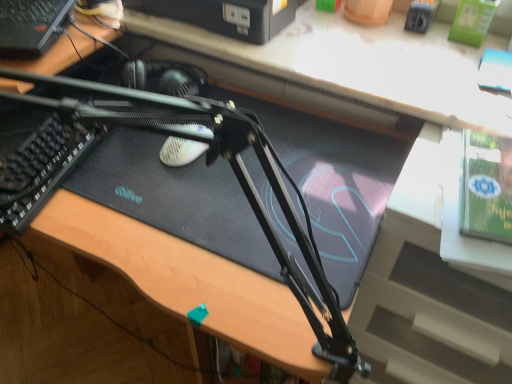
Question: Considering the positions of black plastic computer at upper left, arranged as the second computer when viewed from the right, and black textured keyboard at left in the image, is black plastic computer at upper left, arranged as the second computer when viewed from the right, bigger or smaller than black textured keyboard at left?

Choices:
 (A) small
 (B) big

Answer: (B)

Question: Visually, is black plastic computer at upper left, the 1th computer in the left-to-right sequence, positioned to the left or to the right of black textured keyboard at left?

Choices:
 (A) left
 (B) right

Answer: (A)

Question: Which object is the farthest from the green matte paperback book at upper right?

Choices:
 (A) black matte computer desk at center
 (B) black plastic computer at upper left, arranged as the second computer when viewed from the right
 (C) black textured keyboard at left
 (D) black plastic printer at upper center, acting as the 2th computer starting from the left

Answer: (B)

Question: Which is farther from the black plastic printer at upper center, acting as the 2th computer starting from the left?

Choices:
 (A) green matte paperback book at upper right
 (B) black textured keyboard at left
 (C) black plastic computer at upper left, arranged as the second computer when viewed from the right
 (D) black matte computer desk at center

Answer: (A)